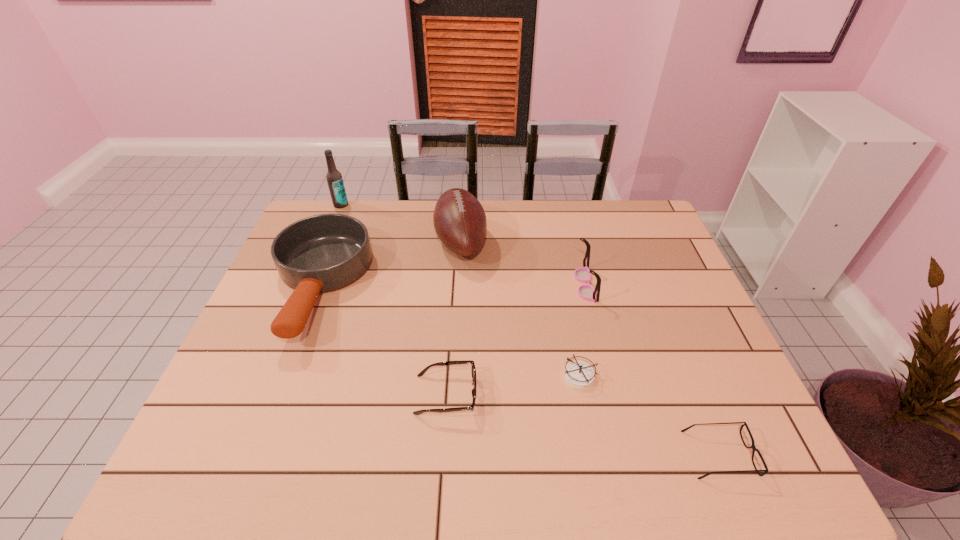
Where is `vacant region located on the label of the beer bottle`? vacant region located on the label of the beer bottle is located at coordinates (328, 236).

Identify the location of free location located 0.270m on the left of the football (American). (352, 241).

At what (x,y) coordinates should I click in order to perform the action: click on vacant space located 0.230m on the front of the tallest spectacles. Please return your answer as a coordinate pair (x, y). Looking at the image, I should click on (606, 370).

At what (x,y) coordinates should I click in order to perform the action: click on free point located 0.140m on the handle side of the fourth tallest object. Please return your answer as a coordinate pair (x, y). Looking at the image, I should click on (275, 403).

The width and height of the screenshot is (960, 540). Identify the location of vacant region located 0.050m on the lenses of the leftmost spectacles. coord(498,394).

The height and width of the screenshot is (540, 960). I want to click on vacant space located on the front of the compass, so click(590, 430).

The width and height of the screenshot is (960, 540). I want to click on vacant space located with the lenses facing outward on the shortest object, so click(x=588, y=455).

Where is `vacant space located 0.160m with the lenses facing outward on the shortest object`? vacant space located 0.160m with the lenses facing outward on the shortest object is located at coordinates (612, 455).

Identify the location of free spot located 0.050m with the lenses facing outward on the shortest object. This screenshot has width=960, height=540. [x=664, y=455].

Locate an element on the screen. This screenshot has height=540, width=960. beer bottle that is at the far edge is located at coordinates (334, 178).